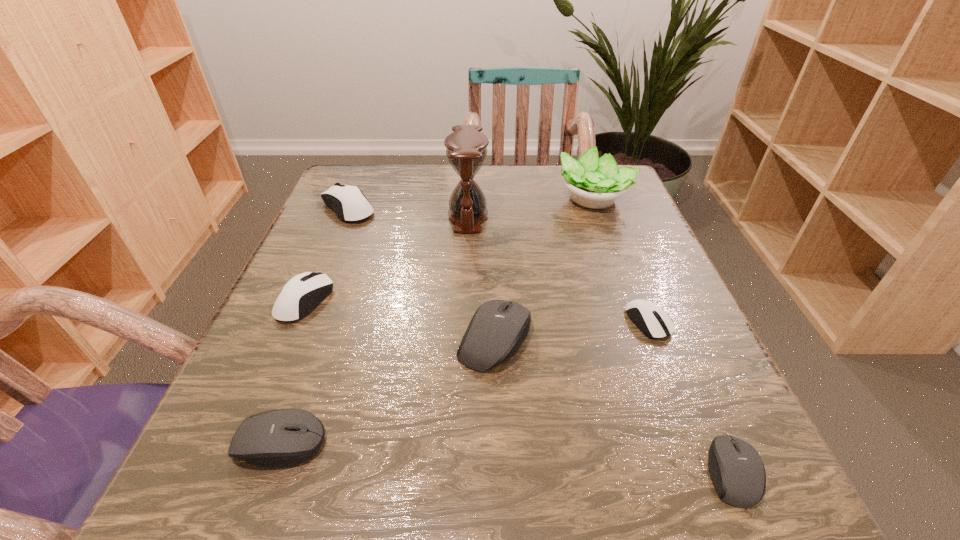
The width and height of the screenshot is (960, 540). Identify the location of the smallest white mouse. (654, 322).

Identify the location of the rightmost black computer equipment. (736, 469).

The height and width of the screenshot is (540, 960). I want to click on free space located on the back of the tallest object, so click(469, 173).

Find the location of a particular element. free space located on the front of the second tallest object is located at coordinates (651, 349).

Locate an element on the screen. free spot located on the right of the farthest computer equipment is located at coordinates (522, 208).

Locate an element on the screen. free space located on the right of the third computer equipment from right to left is located at coordinates (644, 338).

This screenshot has width=960, height=540. I want to click on blank space located 0.150m on the right of the second smallest white mouse, so click(x=416, y=301).

Find the location of a particular element. The width and height of the screenshot is (960, 540). vacant space located 0.180m on the back of the second smallest black computer equipment is located at coordinates (324, 320).

The height and width of the screenshot is (540, 960). What are the coordinates of `blank space located 0.050m on the left of the rightmost white mouse` in the screenshot? It's located at (598, 322).

Find the location of `blank space located 0.140m on the back of the rightmost black computer equipment`. blank space located 0.140m on the back of the rightmost black computer equipment is located at coordinates (681, 354).